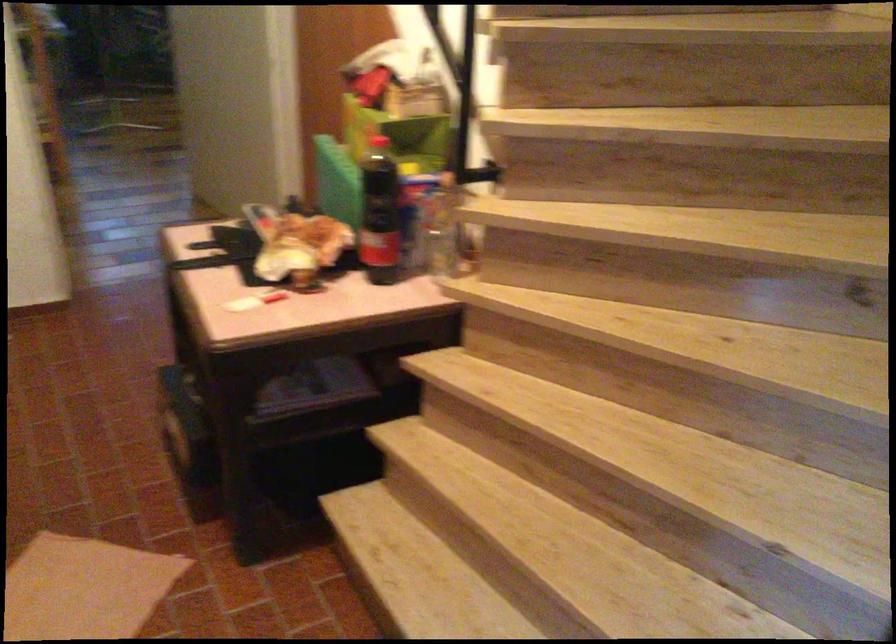
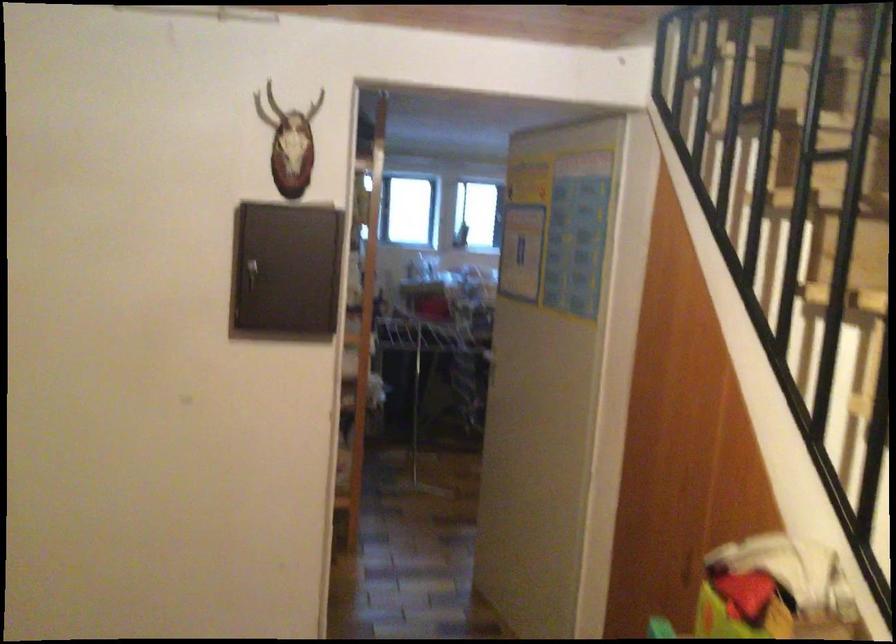
Which direction would the cameraman need to move to produce the second image?

The cameraman walked toward left, forward.